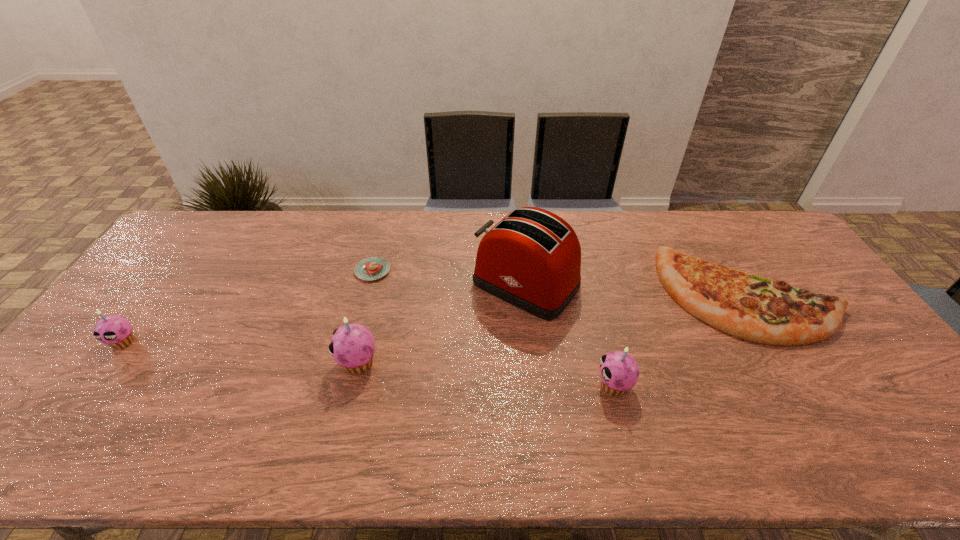
Image resolution: width=960 pixels, height=540 pixels. What are the coordinates of `object that is at the near edge` in the screenshot? It's located at (619, 371).

I want to click on object at the left edge, so click(115, 331).

At what (x,y) coordinates should I click in order to perform the action: click on object that is at the right edge. Please return your answer as a coordinate pair (x, y). The width and height of the screenshot is (960, 540). Looking at the image, I should click on (750, 307).

Where is `vacant space at the far edge of the desktop`? This screenshot has width=960, height=540. vacant space at the far edge of the desktop is located at coordinates (597, 217).

Locate an element on the screen. This screenshot has height=540, width=960. free space at the near edge is located at coordinates (226, 387).

Locate an element on the screen. This screenshot has height=540, width=960. vacant space at the right edge of the desktop is located at coordinates (832, 370).

In the image, there is a desktop. Identify the location of vacant region at the far left corner. (219, 213).

Find the location of a particular element. vacant space at the far right corner of the desktop is located at coordinates (769, 230).

Find the location of a particular element. Image resolution: width=960 pixels, height=540 pixels. vacant space that's between the third shortest object and the rightmost object is located at coordinates (436, 319).

This screenshot has height=540, width=960. Identify the location of empty space between the rightmost object and the tallest object. (637, 290).